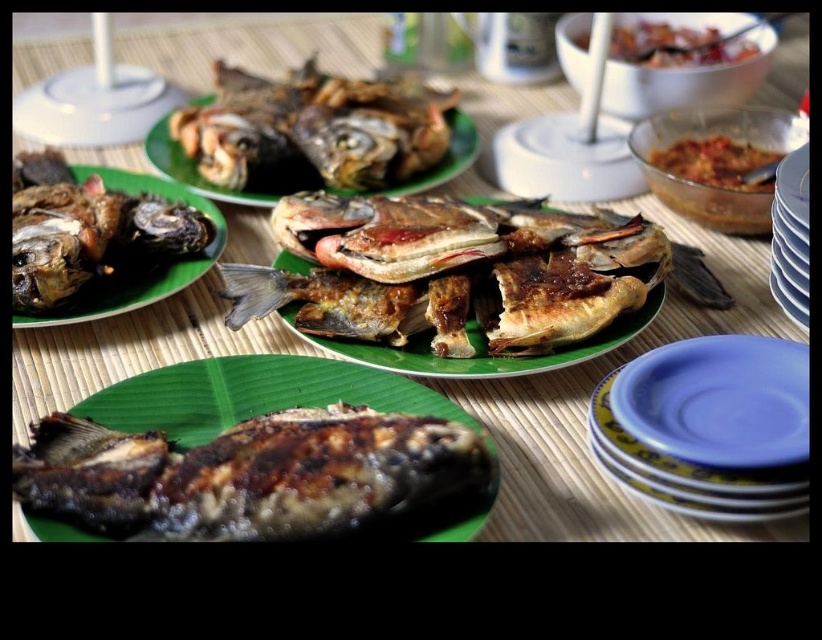
Question: Which point appears farthest from the camera in this image?

Choices:
 (A) (169, 145)
 (B) (776, 300)

Answer: (A)

Question: In this image, where is brown crispy fish at center located relative to tomato paste at upper right?

Choices:
 (A) left
 (B) right

Answer: (A)

Question: Considering the real-world distances, which object is farthest from the green matte plate at center?

Choices:
 (A) brown matte fish at center
 (B) brown crispy fried fish at upper center
 (C) brown matte fish at left
 (D) tomato paste at upper right

Answer: (B)

Question: Is brown crispy fish at center wider than white ceramic plates at right?

Choices:
 (A) no
 (B) yes

Answer: (B)

Question: Which object is positioned farthest from the blue glossy plate at lower right?

Choices:
 (A) brown crispy fish at center
 (B) brown matte fish at left

Answer: (B)

Question: In this image, where is green matte plate at center located relative to tomato paste at upper right?

Choices:
 (A) above
 (B) below

Answer: (B)